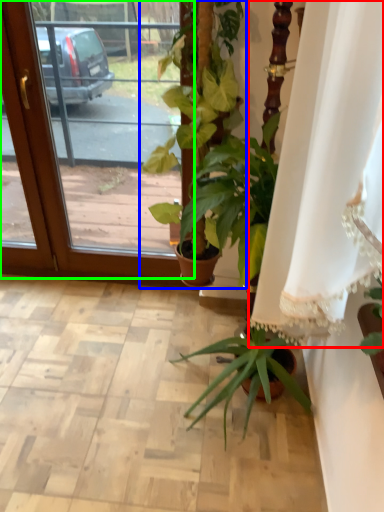
Question: Estimate the real-world distances between objects in this image. Which object is farther from curtain (highlighted by a red box), houseplant (highlighted by a blue box) or screen door (highlighted by a green box)?

Choices:
 (A) houseplant
 (B) screen door

Answer: (B)